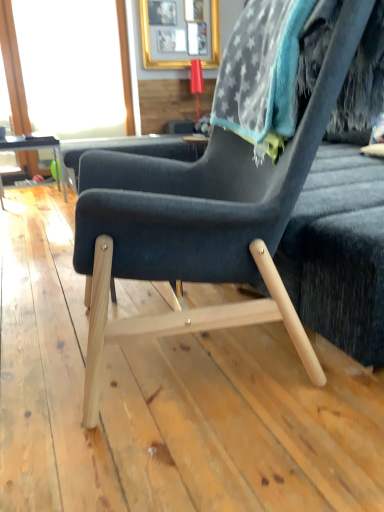
What do you see at coordinates (150, 48) in the screenshot?
I see `gold metallic picture frame at upper center` at bounding box center [150, 48].

You are a GUI agent. You are given a task and a screenshot of the screen. Output one action in this format:
    pyautogui.click(x=<x>, y=<y>)
    Task: Click on the gold metallic picture frame at upper center
    This screenshot has height=512, width=384.
    Given the screenshot: What is the action you would take?
    pyautogui.click(x=150, y=48)

What do you see at coordinates (35, 147) in the screenshot?
I see `matte black table at left` at bounding box center [35, 147].

Measure the distance between point (150, 223) and camera.

Point (150, 223) is 36.50 inches from camera.

The height and width of the screenshot is (512, 384). What do you see at coordinates (200, 222) in the screenshot?
I see `dark blue fabric chair at center` at bounding box center [200, 222].

The height and width of the screenshot is (512, 384). Describe the element at coordinates (125, 65) in the screenshot. I see `transparent glass window screen at upper left` at that location.

Describe the element at coordinates (271, 65) in the screenshot. The image size is (384, 512). I see `gray fuzzy bean bag at upper right` at that location.

At what (x,y) coordinates should I click in order to perform the action: click on gold metallic picture frame at upper center. Please return your answer as a coordinate pair (x, y). This screenshot has width=384, height=512. Looking at the image, I should click on click(x=150, y=48).

In the scene shown: Does gold metallic picture frame at upper center have a smaller size compared to transparent glass window screen at upper left?

Yes.

Does gold metallic picture frame at upper center lie in front of transparent glass window screen at upper left?

No, it is behind transparent glass window screen at upper left.

Can you confirm if gold metallic picture frame at upper center is shorter than transparent glass window screen at upper left?

Indeed, gold metallic picture frame at upper center has a lesser height compared to transparent glass window screen at upper left.

Consider the image. Is gold metallic picture frame at upper center to the left of transparent glass window screen at upper left from the viewer's perspective?

In fact, gold metallic picture frame at upper center is to the right of transparent glass window screen at upper left.

Which is more to the left, gray fuzzy bean bag at upper right or gold metallic picture frame at upper center?

gold metallic picture frame at upper center.

From the image's perspective, which is below, gray fuzzy bean bag at upper right or gold metallic picture frame at upper center?

gray fuzzy bean bag at upper right is shown below in the image.

From a real-world perspective, relative to gold metallic picture frame at upper center, is gray fuzzy bean bag at upper right vertically above or below?

gray fuzzy bean bag at upper right is below gold metallic picture frame at upper center.

From a real-world perspective, is transparent glass window screen at upper left located higher than matte black table at left?

Yes, from a real-world perspective, transparent glass window screen at upper left is above matte black table at left.

Which object is closer to the camera, transparent glass window screen at upper left or matte black table at left?

matte black table at left is more forward.

Is point (9, 28) less distant than point (58, 151)?

No, it is behind (58, 151).

Can you confirm if gold metallic picture frame at upper center is positioned to the right of gray fuzzy bean bag at upper right?

In fact, gold metallic picture frame at upper center is to the left of gray fuzzy bean bag at upper right.

From the picture: Is gold metallic picture frame at upper center completely or partially outside of gray fuzzy bean bag at upper right?

Yes, gold metallic picture frame at upper center is outside of gray fuzzy bean bag at upper right.

Can you tell me how much gold metallic picture frame at upper center and gray fuzzy bean bag at upper right differ in facing direction?

The angle between the facing direction of gold metallic picture frame at upper center and the facing direction of gray fuzzy bean bag at upper right is 97.2 degrees.

Is matte black table at left at the back of gold metallic picture frame at upper center?

No, gold metallic picture frame at upper center is not facing away from matte black table at left.

Is point (151, 69) positioned behind point (28, 140)?

That is True.

Measure the distance from gold metallic picture frame at upper center to matte black table at left.

gold metallic picture frame at upper center and matte black table at left are 1.84 meters apart.

From the image's perspective, is gold metallic picture frame at upper center beneath matte black table at left?

Incorrect, from the image's perspective, gold metallic picture frame at upper center is higher than matte black table at left.

Is transparent glass window screen at upper left facing towards gray fuzzy bean bag at upper right?

Yes.

Can gray fuzzy bean bag at upper right be found inside transparent glass window screen at upper left?

Actually, gray fuzzy bean bag at upper right is outside transparent glass window screen at upper left.

Considering the sizes of objects transparent glass window screen at upper left and gray fuzzy bean bag at upper right in the image provided, who is taller, transparent glass window screen at upper left or gray fuzzy bean bag at upper right?

transparent glass window screen at upper left is taller.

Is transparent glass window screen at upper left next to gray fuzzy bean bag at upper right?

No.

Is point (50, 139) in front of point (179, 62)?

Yes.

Based on the photo, is matte black table at left in front of or behind gold metallic picture frame at upper center in the image?

matte black table at left is positioned closer to the viewer than gold metallic picture frame at upper center.

Are matte black table at left and gold metallic picture frame at upper center located far from each other?

matte black table at left is positioned a significant distance from gold metallic picture frame at upper center.

Could you tell me if matte black table at left is turned towards gold metallic picture frame at upper center?

No, matte black table at left is not turned towards gold metallic picture frame at upper center.

Image resolution: width=384 pixels, height=512 pixels. Find the location of `picture frame above the transparent glass window screen at upper left (from a real-world perspective)`. picture frame above the transparent glass window screen at upper left (from a real-world perspective) is located at coordinates (150, 48).

In order to click on picture frame above the gray fuzzy bean bag at upper right (from the image's perspective) in this screenshot , I will do `click(150, 48)`.

From the image, which object appears to be farther from matte black table at left, gold metallic picture frame at upper center or transparent glass window screen at upper left?

Among the two, gold metallic picture frame at upper center is located further to matte black table at left.

Which object lies further to the anchor point gold metallic picture frame at upper center, gray fuzzy bean bag at upper right or transparent glass window screen at upper left?

Among the two, gray fuzzy bean bag at upper right is located further to gold metallic picture frame at upper center.

Looking at the image, which one is located further to transparent glass window screen at upper left, matte black table at left or gold metallic picture frame at upper center?

matte black table at left is positioned further to the anchor transparent glass window screen at upper left.

Looking at the image, which one is located closer to matte black table at left, gray fuzzy bean bag at upper right or gold metallic picture frame at upper center?

The object closer to matte black table at left is gold metallic picture frame at upper center.

Looking at the image, which one is located further to dark blue fabric chair at center, gray fuzzy bean bag at upper right or gold metallic picture frame at upper center?

Among the two, gold metallic picture frame at upper center is located further to dark blue fabric chair at center.

Considering their positions, is gold metallic picture frame at upper center positioned closer to transparent glass window screen at upper left than gray fuzzy bean bag at upper right?

gold metallic picture frame at upper center is positioned closer to the anchor transparent glass window screen at upper left.

Considering their positions, is gray fuzzy bean bag at upper right positioned closer to transparent glass window screen at upper left than dark blue fabric chair at center?

Based on the image, gray fuzzy bean bag at upper right appears to be nearer to transparent glass window screen at upper left.

Based on the photo, considering their positions, is gray fuzzy bean bag at upper right positioned further to matte black table at left than transparent glass window screen at upper left?

Based on the image, gray fuzzy bean bag at upper right appears to be further to matte black table at left.

Identify the location of window screen between dark blue fabric chair at center and gold metallic picture frame at upper center in the front-back direction. Image resolution: width=384 pixels, height=512 pixels. (125, 65).

Find the location of a particular element. window screen located between gray fuzzy bean bag at upper right and gold metallic picture frame at upper center in the depth direction is located at coordinates (125, 65).

Locate an element on the screen. The height and width of the screenshot is (512, 384). bean bag chair between dark blue fabric chair at center and matte black table at left from front to back is located at coordinates (271, 65).

Locate an element on the screen. The image size is (384, 512). table between dark blue fabric chair at center and gold metallic picture frame at upper center in the front-back direction is located at coordinates (35, 147).